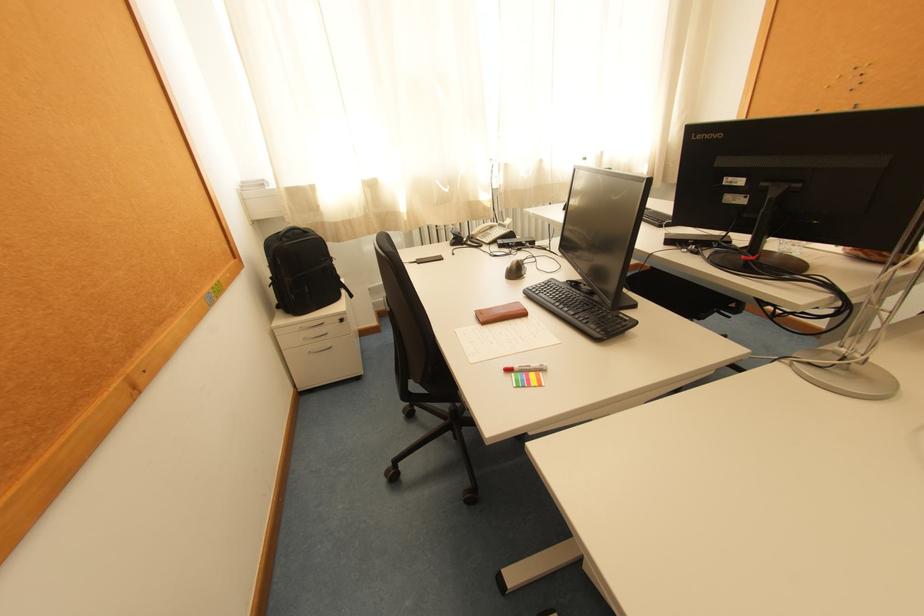
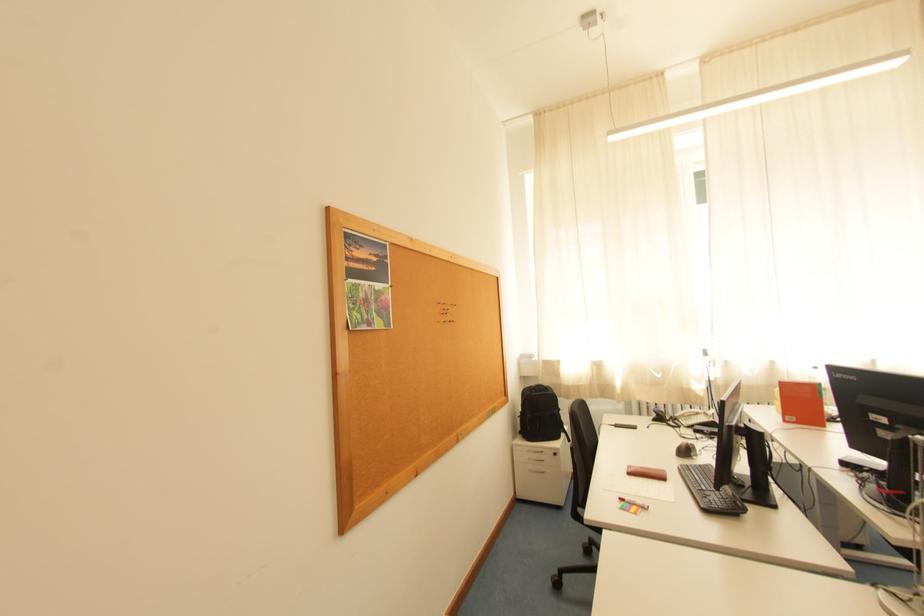
The point at (x=286, y=309) is marked in the first image. Where is the corresponding point in the second image?

(528, 434)